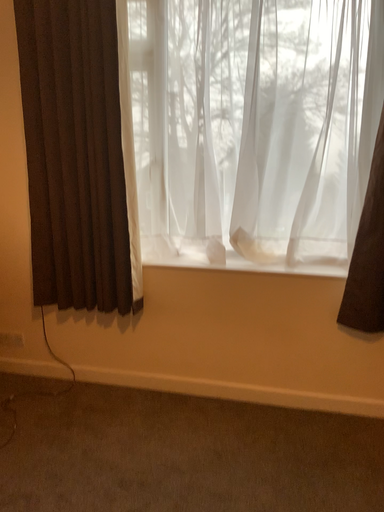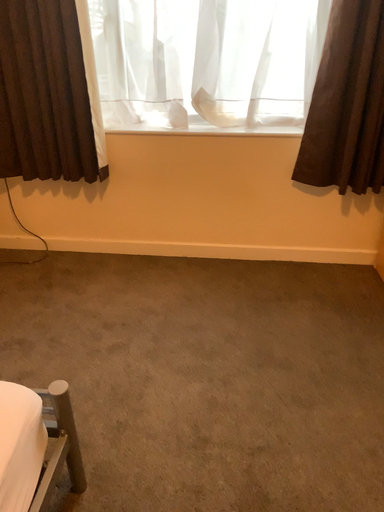
Question: How did the camera likely rotate when shooting the video?

Choices:
 (A) rotated right
 (B) rotated left

Answer: (A)